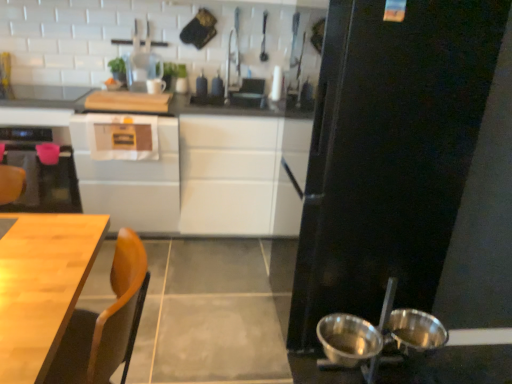
Question: Can you confirm if black matte refrigerator at right is positioned to the left of shiny metallic bowls at lower right, the first bowl in the right-to-left sequence?

Choices:
 (A) no
 (B) yes

Answer: (B)

Question: Does black matte refrigerator at right have a smaller size compared to shiny metallic bowls at lower right, the first bowl in the right-to-left sequence?

Choices:
 (A) no
 (B) yes

Answer: (A)

Question: Is black matte refrigerator at right wider than shiny metallic bowls at lower right, arranged as the second bowl when viewed from the left?

Choices:
 (A) yes
 (B) no

Answer: (A)

Question: Is there a large distance between black matte refrigerator at right and shiny metallic bowls at lower right, arranged as the second bowl when viewed from the left?

Choices:
 (A) no
 (B) yes

Answer: (A)

Question: From a real-world perspective, is black matte refrigerator at right positioned under shiny metallic bowls at lower right, arranged as the second bowl when viewed from the left, based on gravity?

Choices:
 (A) yes
 (B) no

Answer: (B)

Question: In terms of height, does white glossy countertop at upper left look taller or shorter compared to wooden table at lower left?

Choices:
 (A) tall
 (B) short

Answer: (B)

Question: In the image, is white glossy countertop at upper left positioned in front of or behind wooden table at lower left?

Choices:
 (A) behind
 (B) front

Answer: (A)

Question: From the image's perspective, is white glossy countertop at upper left positioned above or below wooden table at lower left?

Choices:
 (A) above
 (B) below

Answer: (A)

Question: In terms of width, does white glossy countertop at upper left look wider or thinner when compared to wooden table at lower left?

Choices:
 (A) thin
 (B) wide

Answer: (A)

Question: Is point (162, 193) closer or farther from the camera than point (396, 347)?

Choices:
 (A) closer
 (B) farther

Answer: (B)

Question: Considering the positions of white glossy cabinet at center, positioned as the second cabinetry in left-to-right order, and shiny metallic bowls at lower right, arranged as the second bowl when viewed from the left, in the image, is white glossy cabinet at center, positioned as the second cabinetry in left-to-right order, wider or thinner than shiny metallic bowls at lower right, arranged as the second bowl when viewed from the left,?

Choices:
 (A) wide
 (B) thin

Answer: (A)

Question: Based on their sizes in the image, would you say white glossy cabinet at center, positioned as the second cabinetry in left-to-right order, is bigger or smaller than shiny metallic bowls at lower right, the first bowl in the right-to-left sequence?

Choices:
 (A) small
 (B) big

Answer: (B)

Question: Based on their positions, is white glossy cabinet at center, positioned as the second cabinetry in left-to-right order, located to the left or right of shiny metallic bowls at lower right, arranged as the second bowl when viewed from the left?

Choices:
 (A) left
 (B) right

Answer: (A)

Question: Is point (82, 200) positioned closer to the camera than point (168, 183)?

Choices:
 (A) closer
 (B) farther

Answer: (B)

Question: Is white glossy cabinet at center, which is the 2th cabinetry in right-to-left order, wider or thinner than white glossy cabinet at center, placed as the first cabinetry when sorted from right to left?

Choices:
 (A) wide
 (B) thin

Answer: (A)